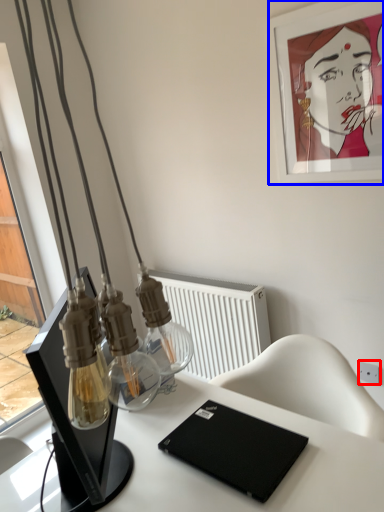
Question: Which object appears farthest to the camera in this image, electric outlet (highlighted by a red box) or picture frame (highlighted by a blue box)?

Choices:
 (A) electric outlet
 (B) picture frame

Answer: (A)